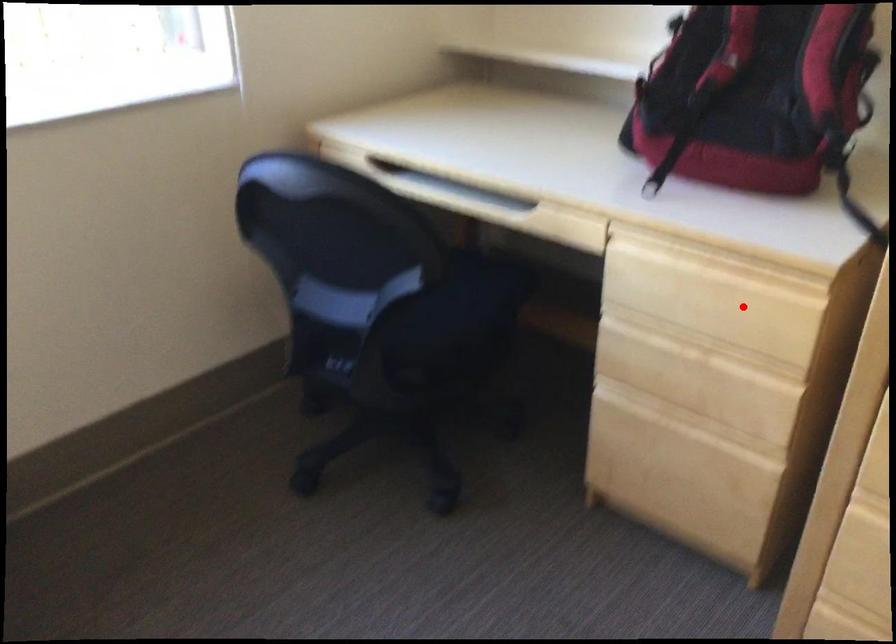
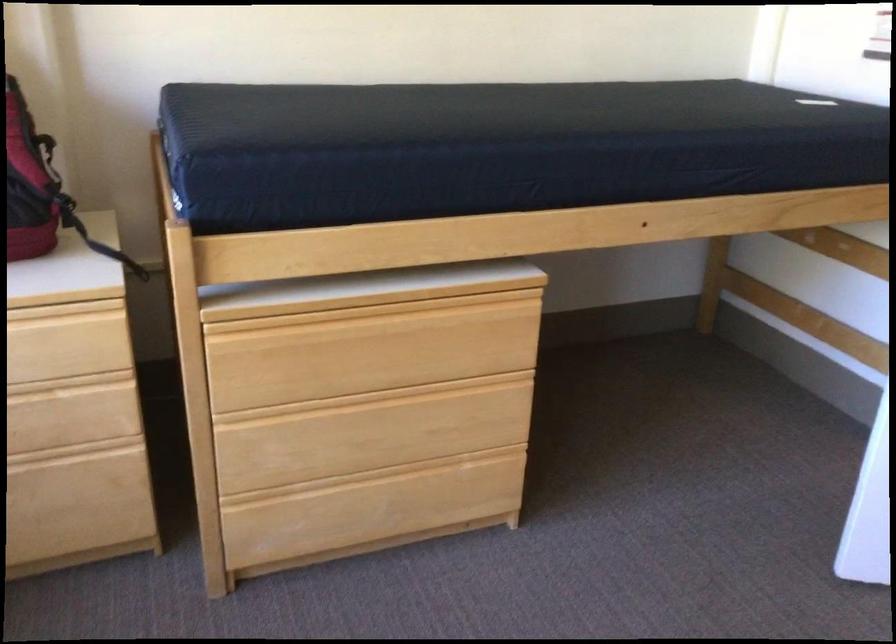
Question: I am providing you with two images of the same scene from different viewpoints. Image1 has a red point marked. In image2, the corresponding 3D location appears at what relative position? Reply with the corresponding letter.

Choices:
 (A) Closer
 (B) Farther

Answer: (B)